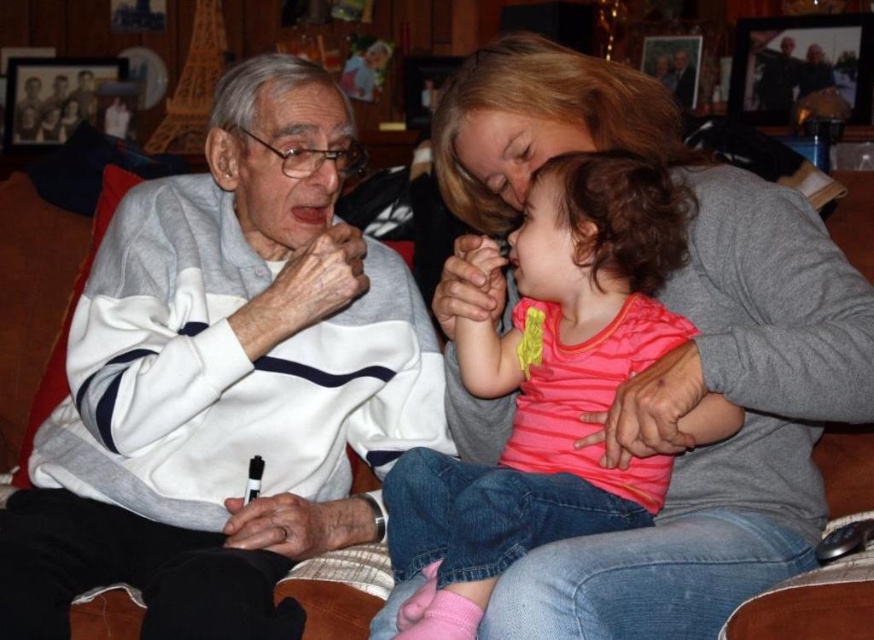
What do you see at coordinates (224, 381) in the screenshot?
I see `white matte sweater at left` at bounding box center [224, 381].

Between white matte sweater at left and pink striped shirt at center, which one has more height?

white matte sweater at left is taller.

Locate an element on the screen. The width and height of the screenshot is (874, 640). white matte sweater at left is located at coordinates (224, 381).